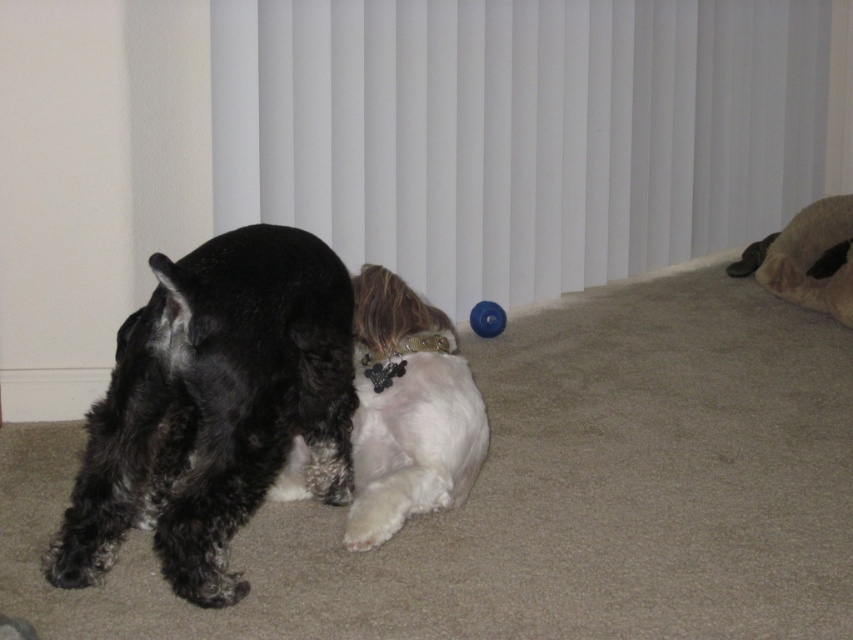
You are a pet sitter who needs to retrieve the blue rubber ball at center from under the white fluffy dog at center. Can you easily reach it without disturbing the dog?

The white fluffy dog at center is positioned under the blue rubber ball at center, so the ball is likely above the dog. This means you can probably reach the blue rubber ball at center without disturbing the white fluffy dog at center by lifting it gently from above.

You are a dog owner who wants to separate your two dogs using a divider. You see the shiny black fur at left and the white fluffy dog at center. Which dog should you place the divider closer to the left side of the room to separate them?

You should place the divider closer to the left side of the room near the shiny black fur at left since it is positioned on the left side of the white fluffy dog at center, ensuring separation between both dogs.

Based on the photo, you are a dog owner who wants to ensure your dog has enough space to stretch out comfortably. Given that the white fluffy dog at center is lying on the carpet, can you determine if the white plastic blinds at upper center are blocking any part of the dog?

The white plastic blinds at upper center are positioned over the white fluffy dog at center, so they are blocking part of the dog.